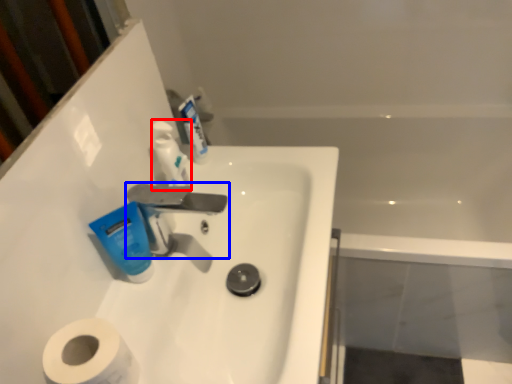
Question: Which point is further to the camera, toiletry (highlighted by a red box) or tap (highlighted by a blue box)?

Choices:
 (A) toiletry
 (B) tap

Answer: (A)